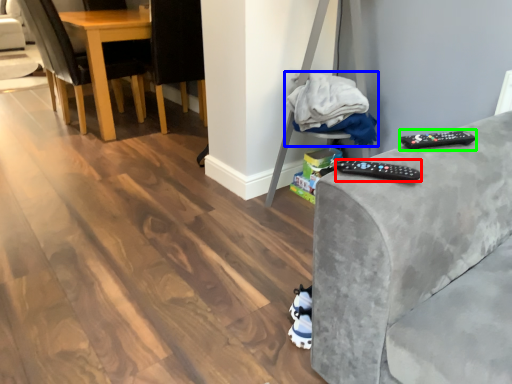
Question: Which object is the closest to the remote (highlighted by a red box)? Choose among these: material (highlighted by a blue box) or remote (highlighted by a green box).

Choices:
 (A) material
 (B) remote

Answer: (B)